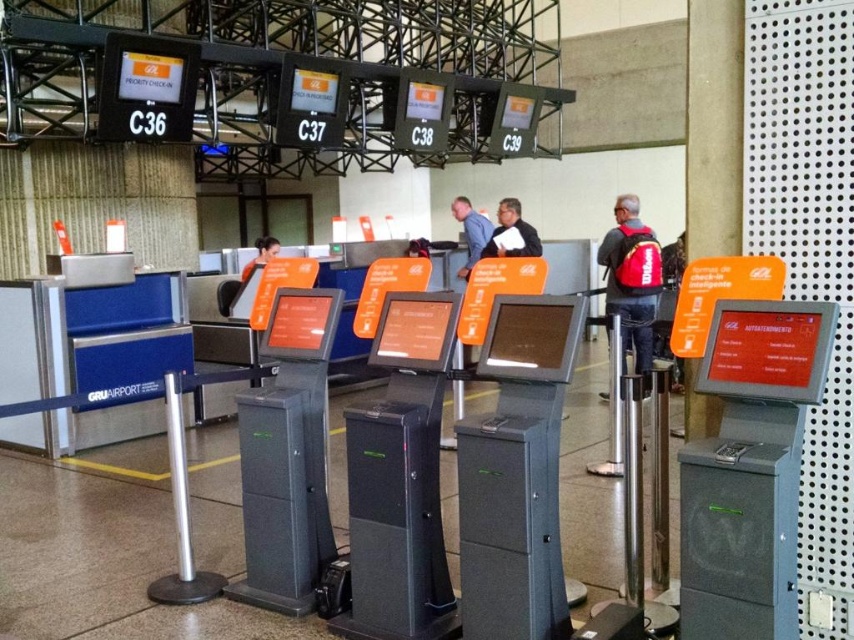
Does point (661, 285) come farther from viewer compared to point (250, 269)?

No, it is not.

Measure the distance between red backpack at center and orange fabric shirt at center.

red backpack at center and orange fabric shirt at center are 3.90 meters apart from each other.

Between point (652, 253) and point (275, 250), which one is positioned behind?

The point (275, 250) is more distant.

At what (x,y) coordinates should I click in order to perform the action: click on red backpack at center. Please return your answer as a coordinate pair (x, y). The image size is (854, 640). Looking at the image, I should click on (632, 278).

Looking at this image, is blue shirt at center above matte black jacket at center?

Correct, blue shirt at center is located above matte black jacket at center.

Which is behind, point (449, 204) or point (522, 228)?

The point (449, 204) is behind.

Is point (474, 218) in front of point (487, 246)?

No, (474, 218) is further to viewer.

Where is `blue shirt at center`? blue shirt at center is located at coordinates (471, 230).

Which of these two, red backpack at center or blue shirt at center, stands taller?

Standing taller between the two is red backpack at center.

Is red backpack at center to the right of blue shirt at center from the viewer's perspective?

Yes, red backpack at center is to the right of blue shirt at center.

Image resolution: width=854 pixels, height=640 pixels. Identify the location of red backpack at center. [632, 278].

Identify the location of red backpack at center. The height and width of the screenshot is (640, 854). (632, 278).